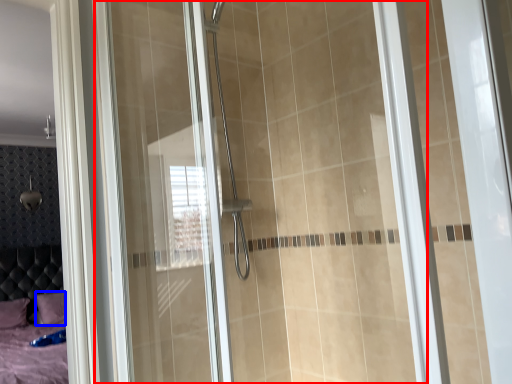
Question: Which of the following is the farthest to the observer, glass door (highlighted by a red box) or pillow (highlighted by a blue box)?

Choices:
 (A) glass door
 (B) pillow

Answer: (B)